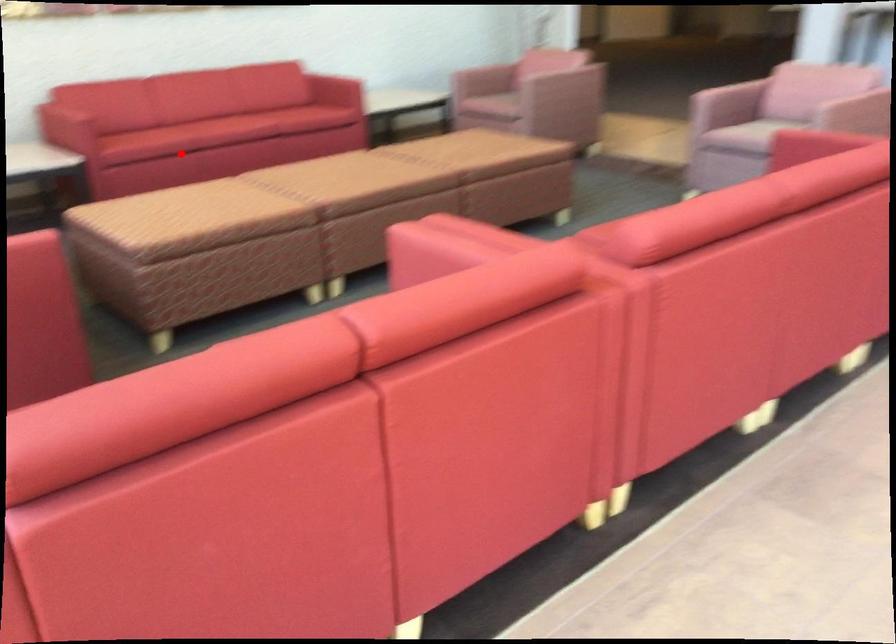
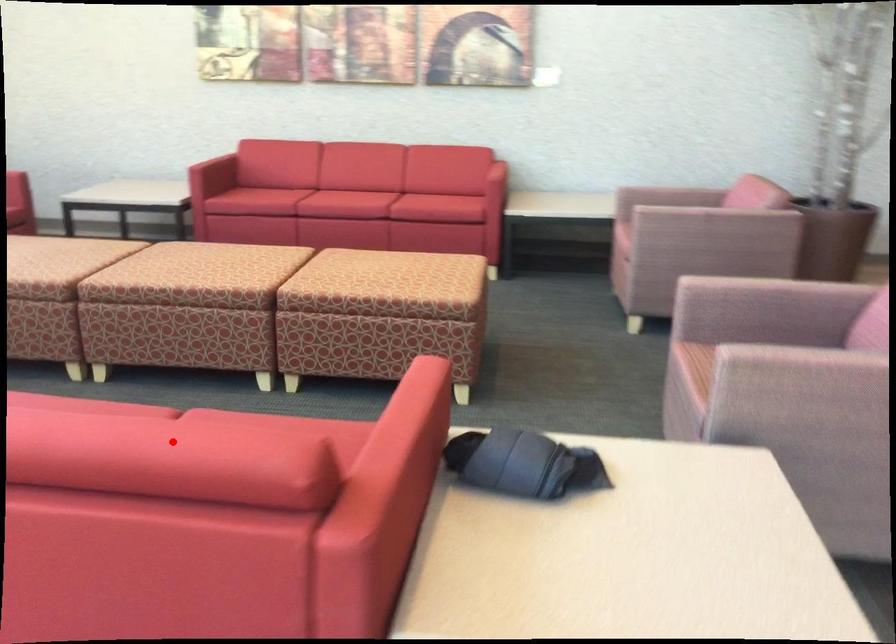
I am providing you with two images of the same scene from different viewpoints. A red point is marked on the first image and another point is marked on the second image. Are the points marked in image1 and image2 representing the same 3D position?

No